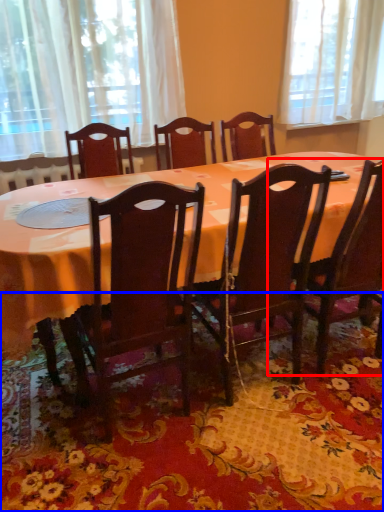
Question: Which point is closer to the camera, chair (highlighted by a red box) or mat (highlighted by a blue box)?

Choices:
 (A) chair
 (B) mat

Answer: (B)